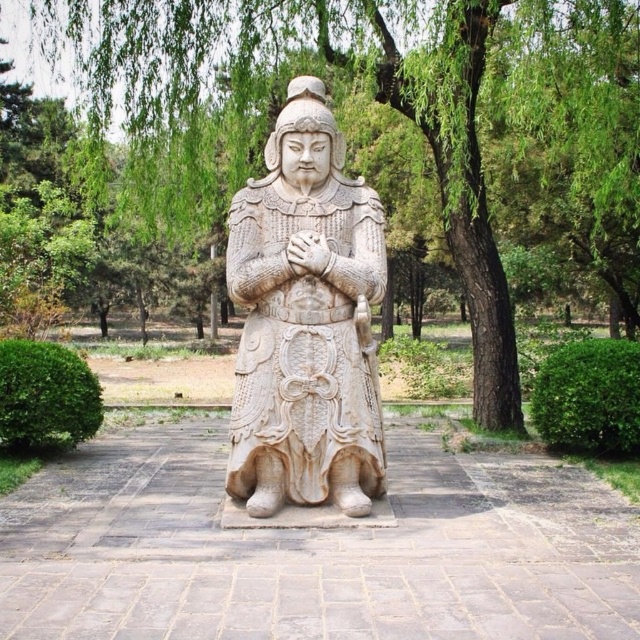
Is green leafy tree at center shorter than white stone statue at center?

Yes.

Does green leafy tree at center have a larger size compared to white stone statue at center?

No.

Which is behind, point (564, 44) or point (324, 458)?

The point (564, 44) is more distant.

The image size is (640, 640). I want to click on green leafy tree at center, so click(381, 104).